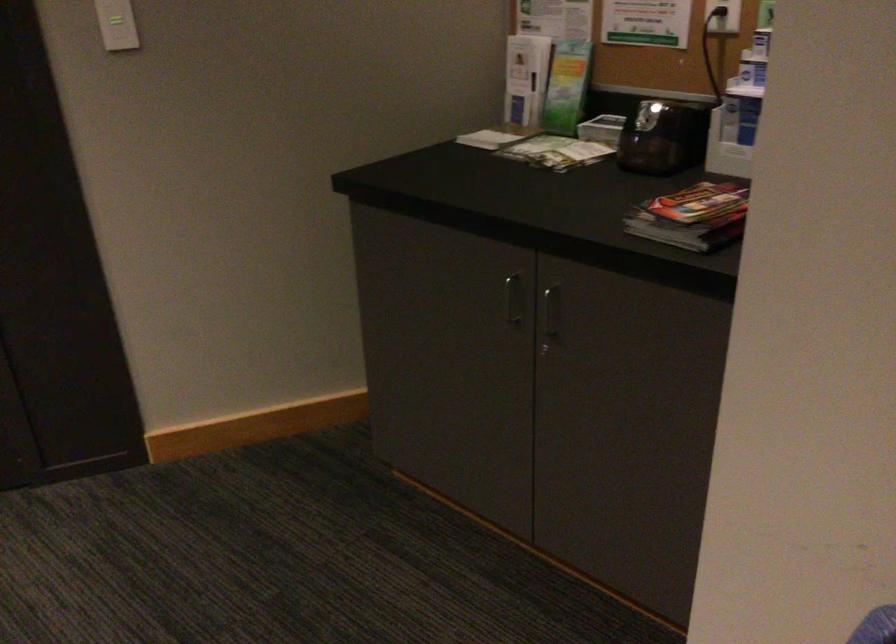
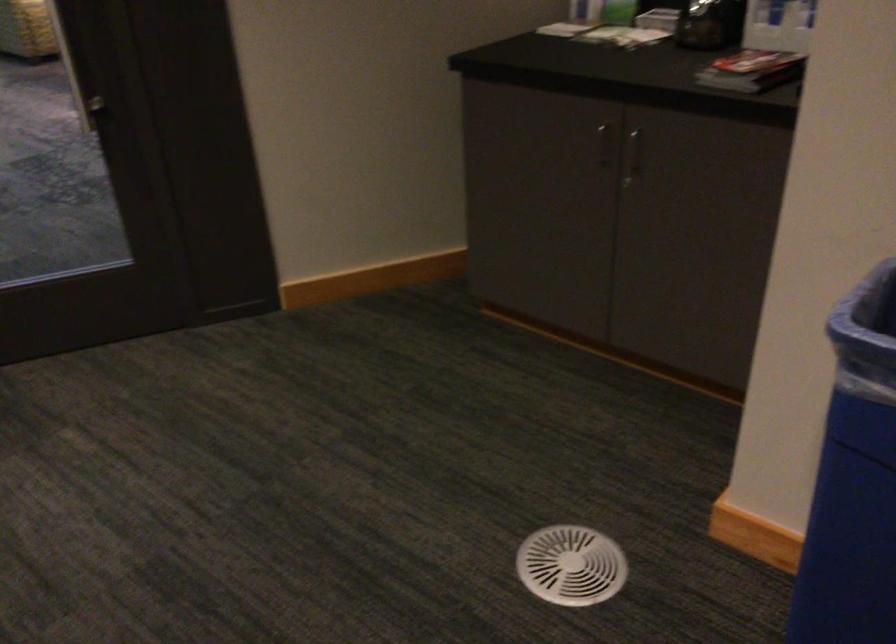
In the second image, find the point that corresponds to (x=515, y=301) in the first image.

(604, 144)